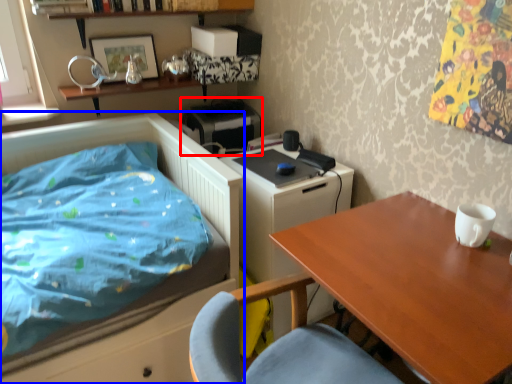
Question: Which object is further to the camera taking this photo, printer (highlighted by a red box) or bed (highlighted by a blue box)?

Choices:
 (A) printer
 (B) bed

Answer: (A)